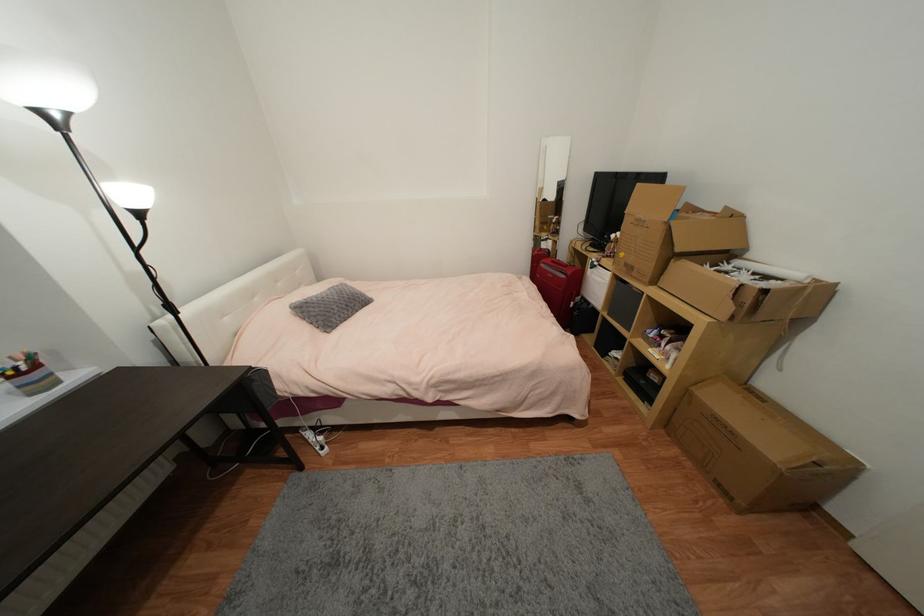
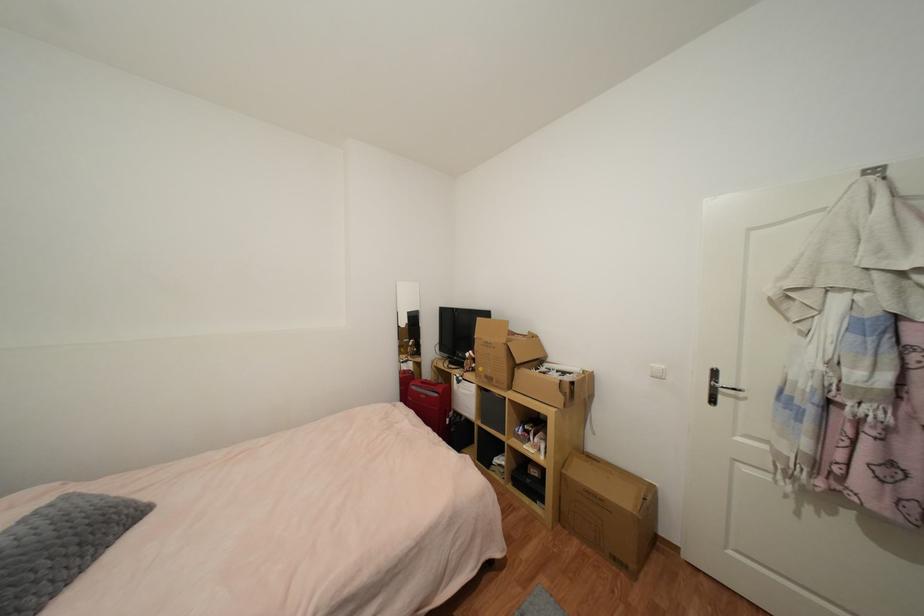
In the second image, find the point that corresponds to pixel 671 426 in the first image.

(564, 517)